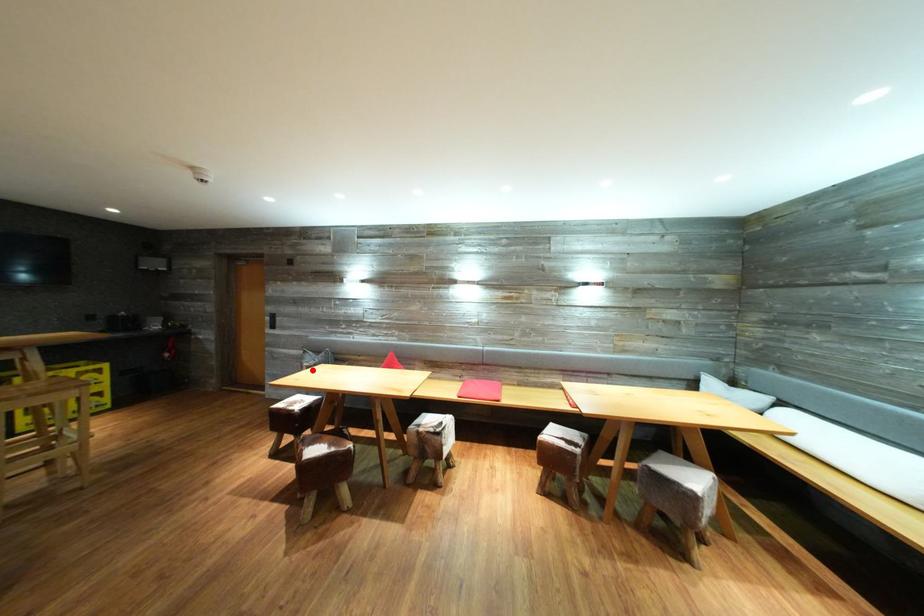
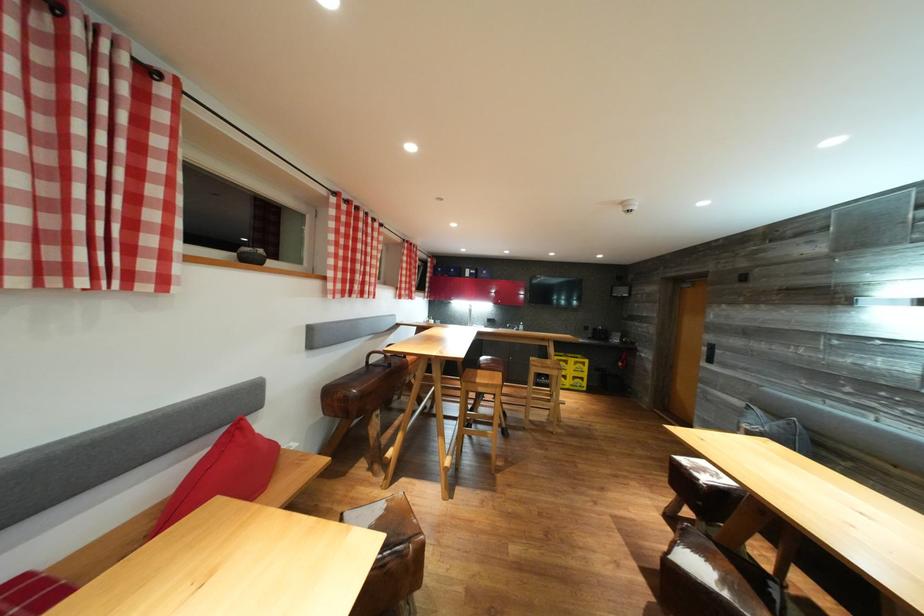
Question: I am providing you with two images of the same scene from different viewpoints. Given a red point in image1, look at the same physical point in image2. Is it:

Choices:
 (A) Closer to the viewpoint
 (B) Farther from the viewpoint

Answer: (A)